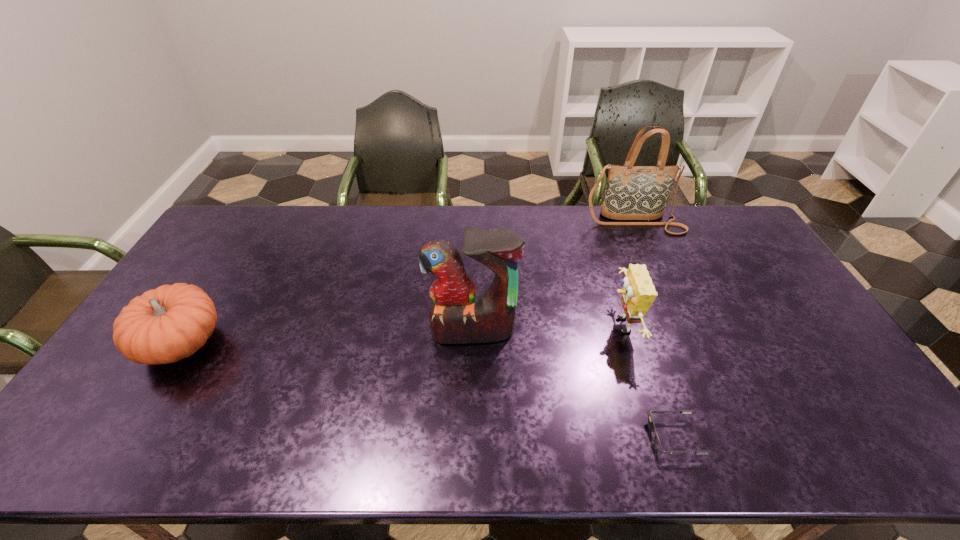
Where is `free space between the third tallest object and the shortest object`? free space between the third tallest object and the shortest object is located at coordinates (648, 381).

Where is `empty space between the fourth tallest object and the parrot`? empty space between the fourth tallest object and the parrot is located at coordinates tap(328, 337).

Where is `the fourth closest object to the pumpkin`? the fourth closest object to the pumpkin is located at coordinates (632, 192).

Select which object appears as the third closest to the pumpkin. Please provide its 2D coordinates. Your answer should be formatted as a tuple, i.e. [(x, y)], where the tuple contains the x and y coordinates of a point satisfying the conditions above.

[(657, 443)]

At what (x,y) coordinates should I click in order to perform the action: click on vacant space that satisfies the following two spatial constraints: 1. on the front-facing side of the handbag; 2. on the face of the third shortest object. Please return your answer as a coordinate pair (x, y). Looking at the image, I should click on (679, 326).

Find the location of a particular element. This screenshot has width=960, height=540. free location that satisfies the following two spatial constraints: 1. on the front-facing side of the handbag; 2. on the face of the sponge is located at coordinates (679, 326).

The height and width of the screenshot is (540, 960). Identify the location of free space that satisfies the following two spatial constraints: 1. on the front-facing side of the handbag; 2. on the face of the sponge. (679, 326).

I want to click on free space that satisfies the following two spatial constraints: 1. on the front-facing side of the farthest object; 2. on the face of the third tallest object, so click(x=679, y=326).

What are the coordinates of `vacant space that satisfies the following two spatial constraints: 1. on the front-facing side of the farthest object; 2. on the face of the sponge` in the screenshot? It's located at (679, 326).